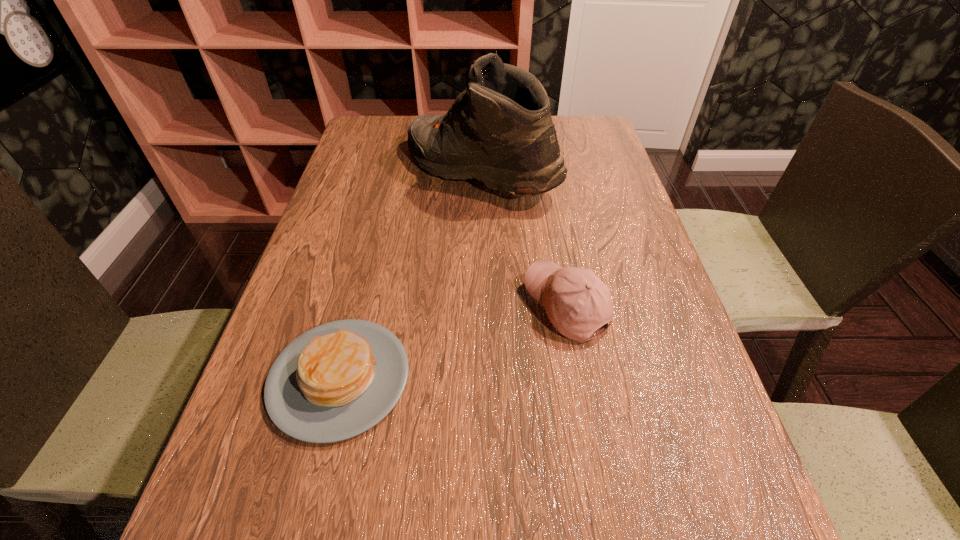
This screenshot has height=540, width=960. What are the coordinates of `empty space that is in between the baseball cap and the shortest object` in the screenshot? It's located at (453, 342).

Identify the location of blank region between the ski boot and the baseball cap. This screenshot has height=540, width=960. (523, 239).

Where is `free space between the shortest object and the farthest object`? This screenshot has width=960, height=540. free space between the shortest object and the farthest object is located at coordinates (410, 275).

Where is `unoccupied area between the pancake and the tallest object`? The width and height of the screenshot is (960, 540). unoccupied area between the pancake and the tallest object is located at coordinates (410, 275).

Identify the location of empty space between the ski boot and the shortest object. (410, 275).

Find the location of a particular element. Image resolution: width=960 pixels, height=540 pixels. vacant point located between the farthest object and the pancake is located at coordinates (410, 275).

Choose which object is the second nearest neighbor to the ski boot. Please provide its 2D coordinates. Your answer should be formatted as a tuple, i.e. [(x, y)], where the tuple contains the x and y coordinates of a point satisfying the conditions above.

[(336, 381)]

The height and width of the screenshot is (540, 960). I want to click on object that is the closest one to the pancake, so click(577, 302).

Where is `free space that satisfies the following two spatial constraints: 1. on the front-facing side of the second tallest object; 2. on the front side of the pancake`? This screenshot has width=960, height=540. free space that satisfies the following two spatial constraints: 1. on the front-facing side of the second tallest object; 2. on the front side of the pancake is located at coordinates (579, 378).

Where is `vacant space that satisfies the following two spatial constraints: 1. on the back side of the shortest object; 2. on the left side of the tallest object`? vacant space that satisfies the following two spatial constraints: 1. on the back side of the shortest object; 2. on the left side of the tallest object is located at coordinates (392, 172).